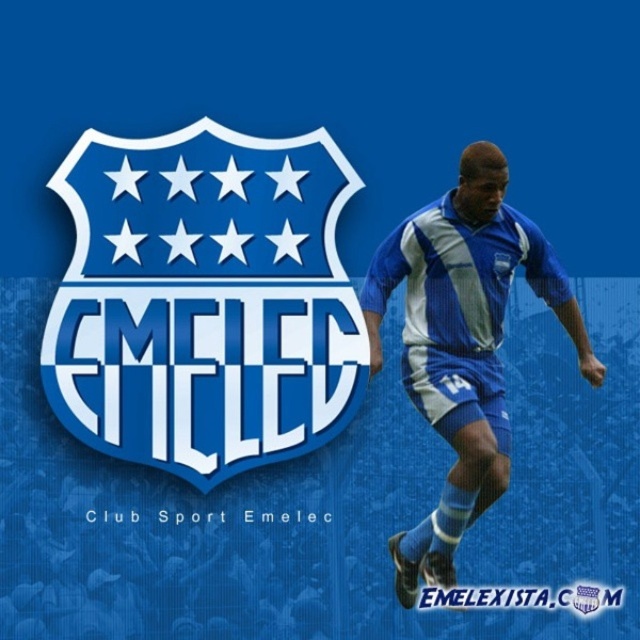
You are designing a digital banner and need to place a text box exactly at the center of the blue glossy shield at center. According to the coordinates provided, what are the coordinates where you should position the text box?

The blue glossy shield at center is located at point [204,300], so you should position the text box at those coordinates to place it exactly at the center of the blue glossy shield at center.

You are a photographer standing in front of the Club Sport Emelec promotional graphic. You notice the blue glossy shield at center and the blue fabric soccer player at center. Which object appears closer to you?

The blue glossy shield at center appears closer to you because it is further to the viewer than the blue fabric soccer player at center.

You are designing a poster and need to place a 2.5 feet wide advertisement between the blue glossy shield at center and the blue fabric soccer player at center. Can you fit it there?

The distance between the blue glossy shield at center and the blue fabric soccer player at center is 4.72 feet. Since the advertisement is 2.5 feet wide, it can fit as long as the total width of the advertisement plus the space between the objects does not exceed the available space. However, the exact placement depends on the poster dimensions not specified here.